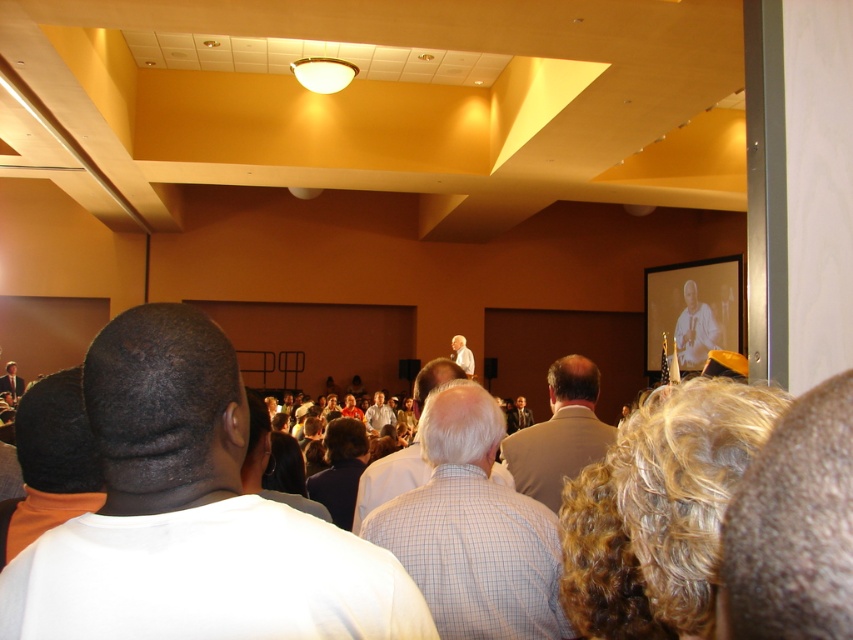
You are a photographer in the back of the room. You want to take a photo of the presenter wearing the light brown suit at center and the light brown leather jacket at center. Which one should you focus on first if you want to capture both in one shot?

The light brown suit at center is located above the light brown leather jacket at center, so you should focus on the light brown suit at center first to ensure both are in focus.

You are an attendee sitting in the front row facing the stage. You see the light brown suit at center and the light brown wooden frame at upper right. Which object is nearer to you?

The light brown suit at center is closer to you than the light brown wooden frame at upper right.